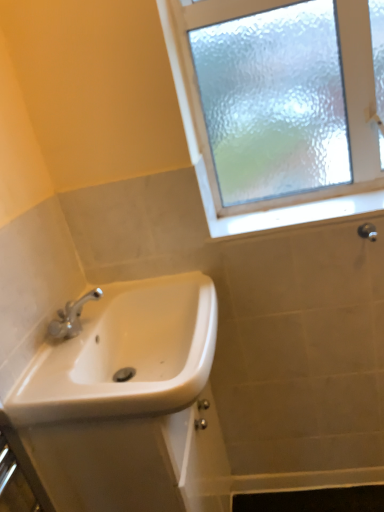
Question: Is white ceramic sink at lower left at the left side of white glossy window sill at upper right?

Choices:
 (A) no
 (B) yes

Answer: (B)

Question: Would you say white ceramic sink at lower left contains white glossy window sill at upper right?

Choices:
 (A) no
 (B) yes

Answer: (A)

Question: Does white ceramic sink at lower left have a greater height compared to white glossy window sill at upper right?

Choices:
 (A) no
 (B) yes

Answer: (B)

Question: Considering the relative sizes of white ceramic sink at lower left and white glossy window sill at upper right in the image provided, is white ceramic sink at lower left bigger than white glossy window sill at upper right?

Choices:
 (A) no
 (B) yes

Answer: (B)

Question: Is white ceramic sink at lower left with white glossy window sill at upper right?

Choices:
 (A) no
 (B) yes

Answer: (A)

Question: From the image's perspective, is white ceramic sink at lower left on white glossy window sill at upper right?

Choices:
 (A) no
 (B) yes

Answer: (A)

Question: Is frosted glass window at upper right facing towards matte silver shower at upper right?

Choices:
 (A) no
 (B) yes

Answer: (B)

Question: Does frosted glass window at upper right appear on the right side of matte silver shower at upper right?

Choices:
 (A) no
 (B) yes

Answer: (A)

Question: Is frosted glass window at upper right further to the viewer compared to matte silver shower at upper right?

Choices:
 (A) no
 (B) yes

Answer: (A)

Question: Does frosted glass window at upper right have a greater width compared to matte silver shower at upper right?

Choices:
 (A) no
 (B) yes

Answer: (B)

Question: Would you say frosted glass window at upper right is outside matte silver shower at upper right?

Choices:
 (A) yes
 (B) no

Answer: (A)

Question: From the image's perspective, is frosted glass window at upper right over matte silver shower at upper right?

Choices:
 (A) yes
 (B) no

Answer: (A)

Question: Considering the relative sizes of white glossy window sill at upper right and frosted glass window at upper right in the image provided, is white glossy window sill at upper right shorter than frosted glass window at upper right?

Choices:
 (A) yes
 (B) no

Answer: (A)